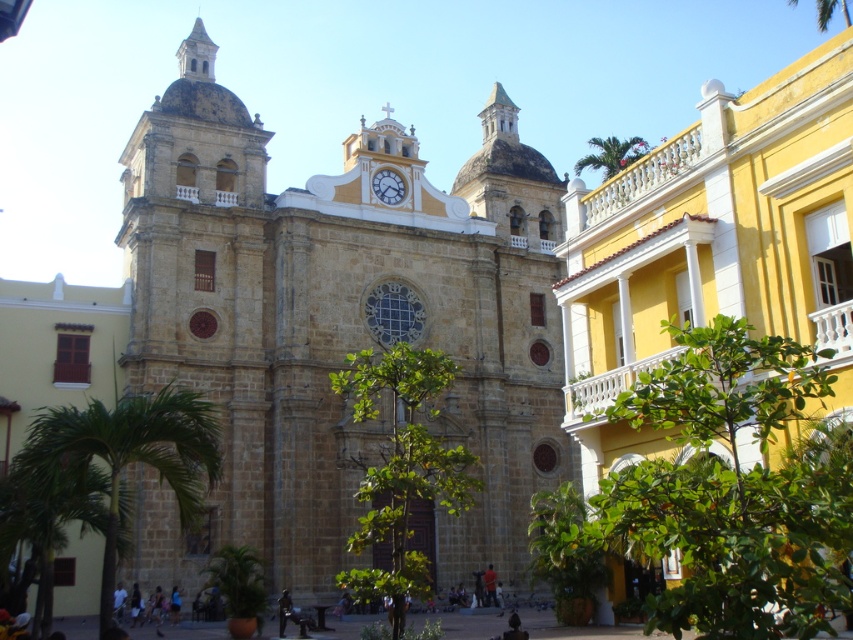
How much distance is there between yellow stucco building at right and green leafy palm tree at lower left?

yellow stucco building at right and green leafy palm tree at lower left are 87.89 feet apart from each other.

Can you confirm if yellow stucco building at right is wider than green leafy palm tree at lower left?

Indeed, yellow stucco building at right has a greater width compared to green leafy palm tree at lower left.

Where is `yellow stucco building at right`? Image resolution: width=853 pixels, height=640 pixels. yellow stucco building at right is located at coordinates (712, 244).

Between stone church at center and green leafy palm tree at upper right, which one is positioned higher?

green leafy palm tree at upper right

Does point (160, 237) come closer to viewer compared to point (633, 156)?

Yes, point (160, 237) is closer to viewer.

Identify the location of stone church at center. (338, 324).

At what (x,y) coordinates should I click in order to perform the action: click on stone church at center. Please return your answer as a coordinate pair (x, y). Image resolution: width=853 pixels, height=640 pixels. Looking at the image, I should click on (338, 324).

Does green leafy palm tree at left appear over green leafy palm tree at lower left?

Indeed, green leafy palm tree at left is positioned over green leafy palm tree at lower left.

Which is behind, point (80, 460) or point (231, 547)?

The point (231, 547) is more distant.

Which is in front, point (119, 413) or point (242, 582)?

Point (119, 413)

Image resolution: width=853 pixels, height=640 pixels. What are the coordinates of `green leafy palm tree at left` in the screenshot? It's located at (132, 452).